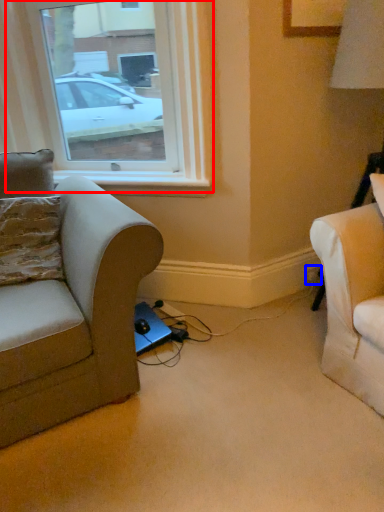
Question: Among these objects, which one is farthest to the camera, window (highlighted by a red box) or electric outlet (highlighted by a blue box)?

Choices:
 (A) window
 (B) electric outlet

Answer: (B)